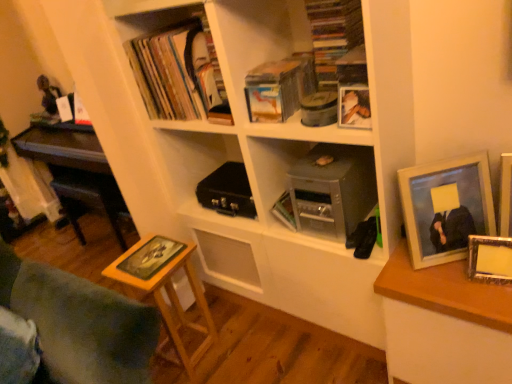
Question: Would you say metallic gray briefcase at center is a long distance from matte black book at upper left, arranged as the second book when viewed from the left?

Choices:
 (A) yes
 (B) no

Answer: (B)

Question: From a real-world perspective, is metallic gray briefcase at center on matte black book at upper left, positioned as the 1th book in top-to-bottom order?

Choices:
 (A) yes
 (B) no

Answer: (B)

Question: Considering the relative sizes of metallic gray briefcase at center and matte black book at upper left, arranged as the second book when viewed from the left, in the image provided, is metallic gray briefcase at center bigger than matte black book at upper left, arranged as the second book when viewed from the left,?

Choices:
 (A) no
 (B) yes

Answer: (A)

Question: Is the depth of metallic gray briefcase at center greater than that of matte black book at upper left, acting as the 2th book starting from the right?

Choices:
 (A) yes
 (B) no

Answer: (B)

Question: Is metallic gray briefcase at center shorter than matte black book at upper left, the third book ordered from the bottom?

Choices:
 (A) yes
 (B) no

Answer: (A)

Question: Is matte black book at upper left, acting as the 2th book starting from the right, taller or shorter than wooden stool at lower left?

Choices:
 (A) tall
 (B) short

Answer: (B)

Question: Considering the positions of point (202, 109) and point (28, 269), is point (202, 109) closer or farther from the camera than point (28, 269)?

Choices:
 (A) closer
 (B) farther

Answer: (B)

Question: From a real-world perspective, is matte black book at upper left, positioned as the 1th book in top-to-bottom order, positioned above or below wooden stool at lower left?

Choices:
 (A) above
 (B) below

Answer: (A)

Question: Is matte black book at upper left, the third book ordered from the bottom, spatially inside wooden stool at lower left, or outside of it?

Choices:
 (A) outside
 (B) inside

Answer: (A)

Question: Is matte silver picture frame at right, positioned as the 1th picture frame in right-to-left order, to the left or to the right of matte black book at upper left, arranged as the second book when viewed from the left, in the image?

Choices:
 (A) right
 (B) left

Answer: (A)

Question: From a real-world perspective, is matte silver picture frame at right, positioned as the 1th picture frame in right-to-left order, physically located above or below matte black book at upper left, the third book ordered from the bottom?

Choices:
 (A) below
 (B) above

Answer: (A)

Question: From the image's perspective, is matte silver picture frame at right, positioned as the 1th picture frame in right-to-left order, positioned above or below matte black book at upper left, positioned as the 1th book in top-to-bottom order?

Choices:
 (A) below
 (B) above

Answer: (A)

Question: Is matte silver picture frame at right, positioned as the 1th picture frame in right-to-left order, in front of or behind matte black book at upper left, acting as the 2th book starting from the right, in the image?

Choices:
 (A) front
 (B) behind

Answer: (A)

Question: Considering the positions of point click(x=178, y=100) and point click(x=498, y=243), is point click(x=178, y=100) closer or farther from the camera than point click(x=498, y=243)?

Choices:
 (A) farther
 (B) closer

Answer: (A)

Question: From the image's perspective, relative to wooden photo frame at right, which ranks as the third picture frame in left-to-right order, is matte black book at upper left, positioned as the 1th book in top-to-bottom order, above or below?

Choices:
 (A) below
 (B) above

Answer: (B)